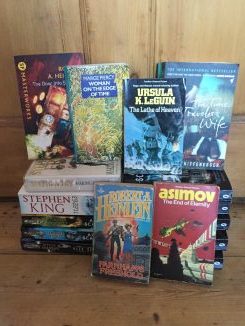
This screenshot has height=326, width=245. Find the location of `books on the side`. books on the side is located at coordinates (71, 184), (71, 205), (71, 221), (70, 230), (70, 246), (224, 192), (224, 205), (224, 219), (224, 239), (219, 259).